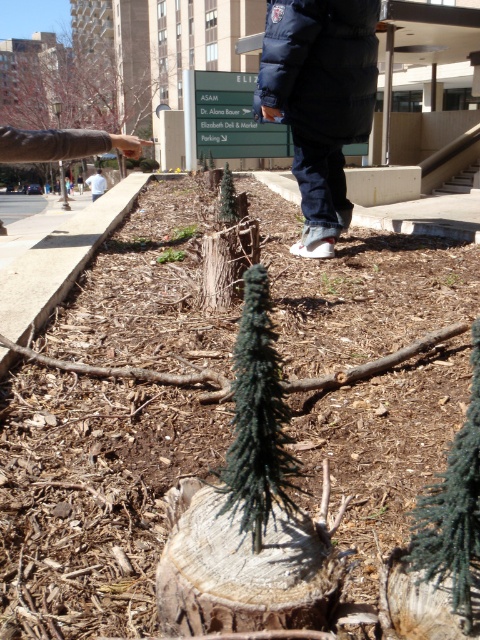
Question: Considering the real-world distances, which object is closest to the white cotton shirt at upper left?

Choices:
 (A) green matte pine at center
 (B) navy blue puffer jacket at upper center

Answer: (B)

Question: Can you confirm if navy blue puffer jacket at upper center is positioned below white cotton shirt at upper left?

Choices:
 (A) yes
 (B) no

Answer: (A)

Question: Among these objects, which one is farthest from the camera?

Choices:
 (A) green matte pine at center
 (B) navy blue puffer jacket at upper center
 (C) green artificial tree at upper center

Answer: (C)

Question: Can you confirm if navy blue puffer jacket at upper center is wider than white cotton shirt at upper left?

Choices:
 (A) no
 (B) yes

Answer: (A)

Question: Is green matte pine at center bigger than white cotton shirt at upper left?

Choices:
 (A) yes
 (B) no

Answer: (B)

Question: Which point appears farthest from the camera in this image?

Choices:
 (A) (252, 337)
 (B) (95, 196)

Answer: (B)